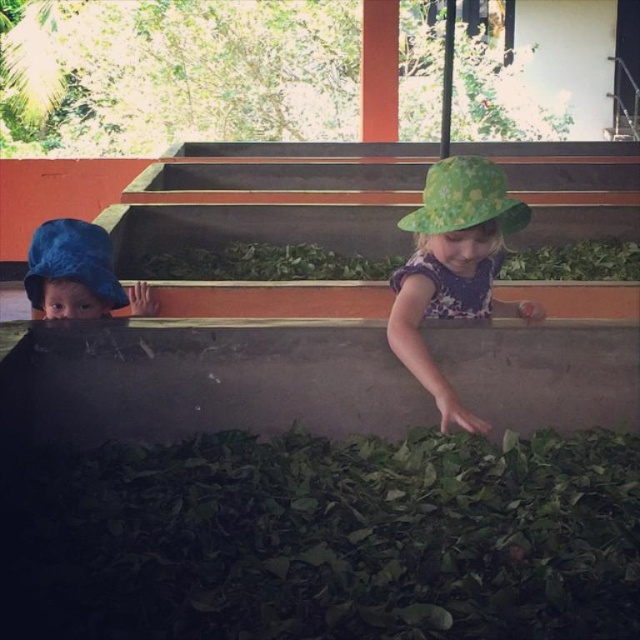
You are standing in front of the container with tea leaves and want to place a small marker at two specific points. The first point is at coordinates point (440, 378) and the second point is at point (96, 282). Which point is closer to you?

Point (440, 378) is closer to the viewer than point (96, 282).

You are a tailor observing the two children in the tea processing facility. You need to determine which hat requires more fabric to make between the green fabric hat at upper right and the blue fabric hat at left. Based on the information provided, which hat would need more fabric?

The green fabric hat at upper right requires more fabric than the blue fabric hat at left because its width surpasses the blue fabric hat at left.

From the picture: You are a photographer taking a picture of the green floral hat at center and the blue fabric hat at left. Which hat should you focus on first if you want to capture both in the frame without moving the camera?

The blue fabric hat at left should be focused on first since it is closer to the camera than the green floral hat at center, ensuring both are in the frame without needing to adjust the camera position.